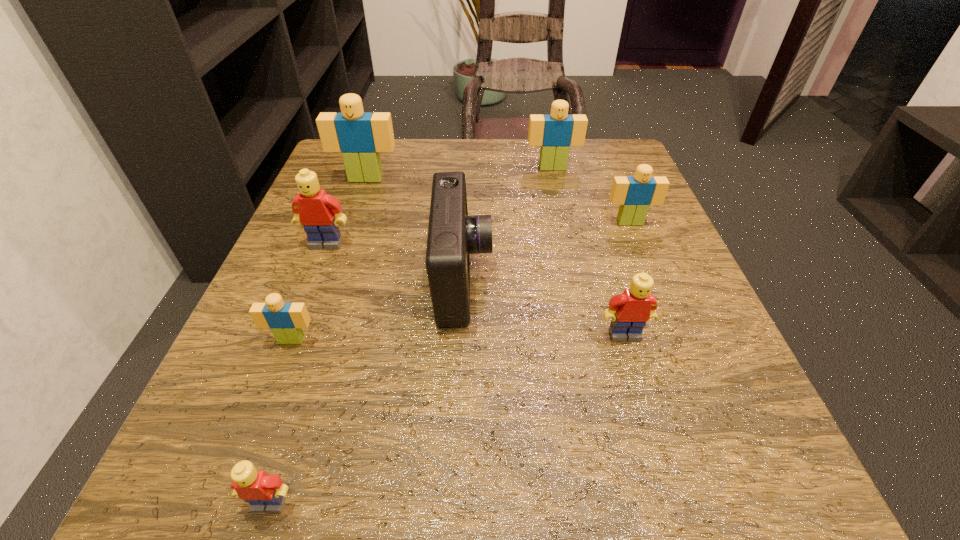
Where is `free point located 0.050m on the front-facing side of the rightmost yellow Lego`? This screenshot has height=540, width=960. free point located 0.050m on the front-facing side of the rightmost yellow Lego is located at coordinates (636, 372).

You are a GUI agent. You are given a task and a screenshot of the screen. Output one action in this format:
    pyautogui.click(x=<x>, y=<y>)
    Task: Click on the free space located 0.090m on the face of the nearest beige Lego
    The width and height of the screenshot is (960, 540).
    Given the screenshot: What is the action you would take?
    pyautogui.click(x=268, y=402)

The width and height of the screenshot is (960, 540). In order to click on object located in the near edge section of the desktop in this screenshot , I will do `click(265, 493)`.

Identify the location of object at the far left corner. (360, 136).

The height and width of the screenshot is (540, 960). What are the coordinates of `object present at the near left corner` in the screenshot? It's located at (265, 493).

The width and height of the screenshot is (960, 540). In order to click on object located in the far right corner section of the desktop in this screenshot , I will do `click(555, 133)`.

The image size is (960, 540). Identify the location of vacant region at the far edge of the desktop. click(424, 190).

Locate an element on the screen. vacant area at the near edge is located at coordinates (501, 485).

You are a GUI agent. You are given a task and a screenshot of the screen. Output one action in this format:
    pyautogui.click(x=<x>, y=<y>)
    Task: Click on the vacant space at the left edge
    Image resolution: width=960 pixels, height=540 pixels.
    Given the screenshot: What is the action you would take?
    pyautogui.click(x=372, y=200)

Locate an element on the screen. The image size is (960, 540). free region at the right edge is located at coordinates (672, 272).